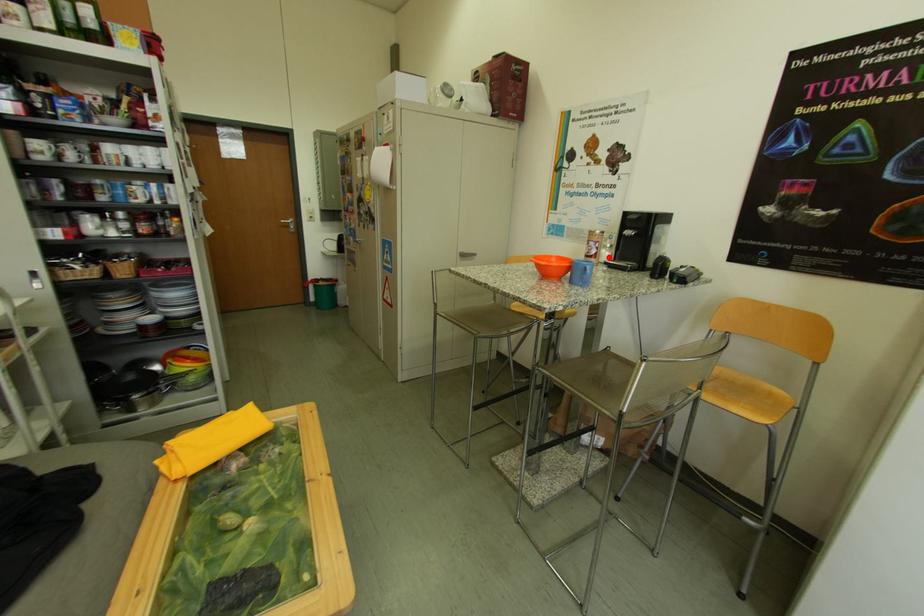
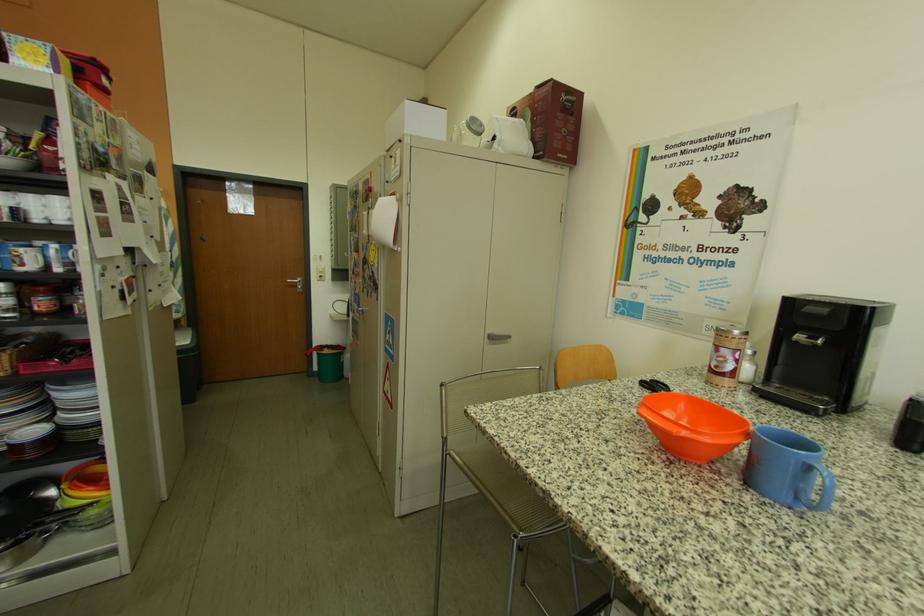
The point at the highlighted location is marked in the first image. Where is the corresponding point in the second image?

(747, 373)